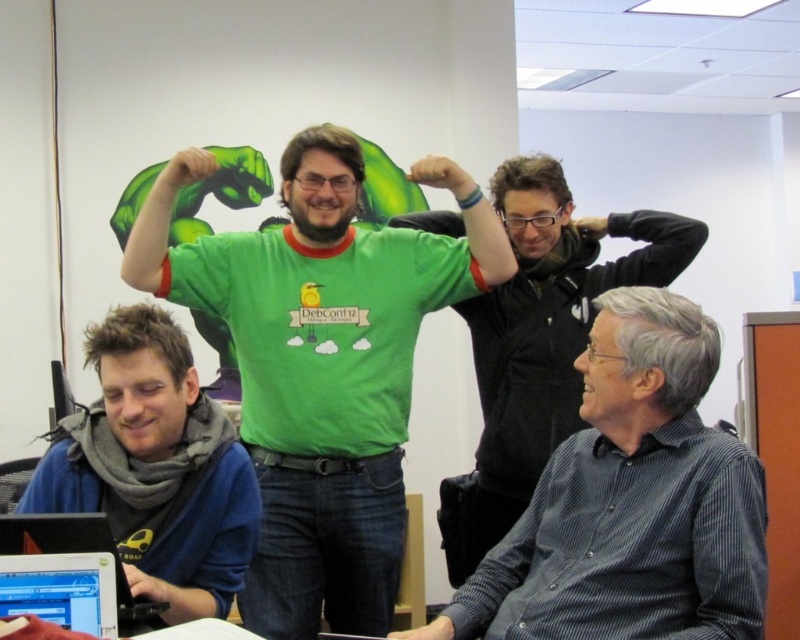
Question: Which object is positioned closest to the blue fleece at lower left?

Choices:
 (A) matte black hand at upper center
 (B) green matte t-shirt at upper center

Answer: (B)

Question: Does green matte hand at upper center have a larger size compared to matte black hand at upper center?

Choices:
 (A) no
 (B) yes

Answer: (B)

Question: Does matte black shirt at lower right have a smaller size compared to silver metallic laptop at lower left?

Choices:
 (A) no
 (B) yes

Answer: (A)

Question: Does black glossy laptop at lower left appear on the right side of green matte t-shirt at upper center?

Choices:
 (A) no
 (B) yes

Answer: (A)

Question: Estimate the real-world distances between objects in this image. Which object is farther from the green matte t-shirt at upper center?

Choices:
 (A) black glossy laptop at lower left
 (B) blue fleece at lower left
 (C) striped cotton shirt at right
 (D) matte black hand at lower center

Answer: (A)

Question: Among these points, which one is nearest to the camera?

Choices:
 (A) (165, 600)
 (B) (402, 636)
 (C) (672, 234)

Answer: (B)